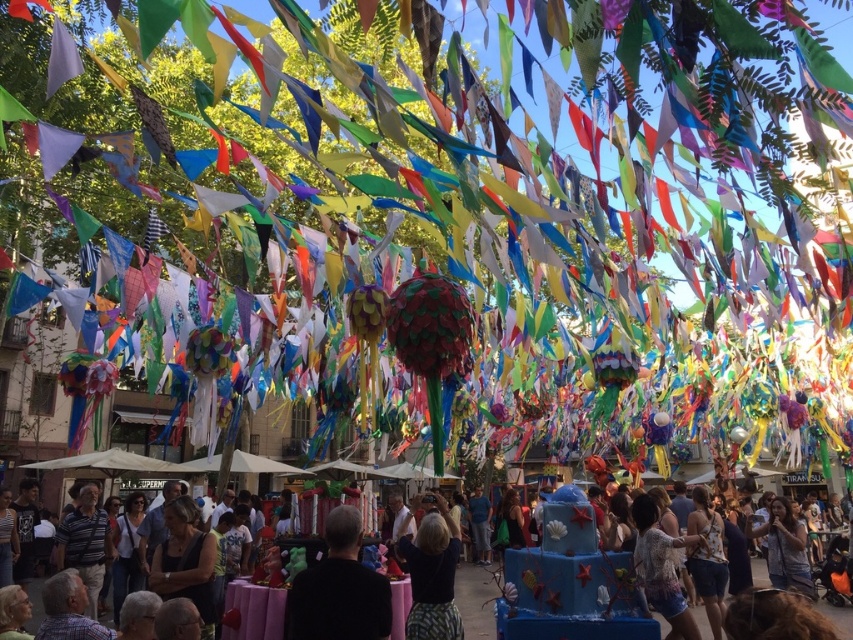
Is point (323, 580) behind point (440, 592)?

No, it is in front of (440, 592).

Can you confirm if black matte shirt at center is positioned to the right of dark blue fabric at center?

No, black matte shirt at center is not to the right of dark blue fabric at center.

Is point (338, 614) farther from viewer compared to point (428, 612)?

No.

Image resolution: width=853 pixels, height=640 pixels. I want to click on black matte shirt at center, so click(x=339, y=588).

Does dark blue fabric at center have a lesser height compared to matte black shirt at center?

Yes.

Which is behind, point (442, 563) or point (762, 582)?

Point (762, 582)

Which is in front, point (401, 552) or point (756, 564)?

Point (401, 552)

The image size is (853, 640). I want to click on dark blue fabric at center, so click(x=431, y=573).

Is black matte shirt at center positioned before matte black shirt at center?

Yes.

Describe the element at coordinates (339, 588) in the screenshot. The image size is (853, 640). I see `black matte shirt at center` at that location.

Identify the location of black matte shirt at center. (339, 588).